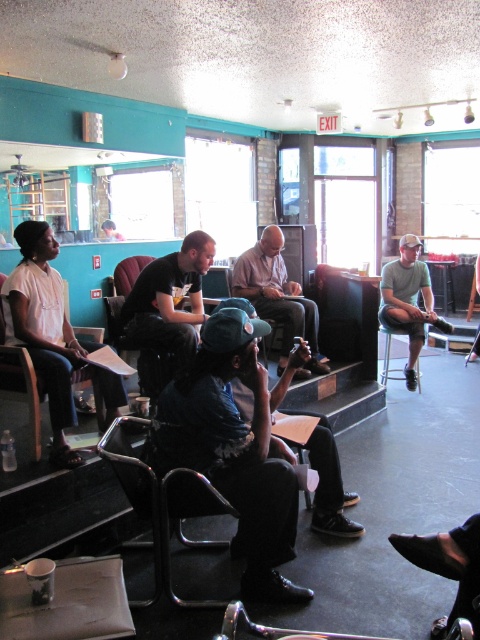
Question: Among these points, which one is nearest to the camera?

Choices:
 (A) (123, 348)
 (B) (280, 284)

Answer: (A)

Question: Which of these objects is positioned farthest from the smooth brown leather jacket at center?

Choices:
 (A) black metal chair at center
 (B) metallic silver chair at left

Answer: (A)

Question: Can you confirm if black matte shirt at center is positioned above smooth brown leather jacket at center?

Choices:
 (A) yes
 (B) no

Answer: (B)

Question: Observing the image, what is the correct spatial positioning of black metal chair at center in reference to smooth brown leather jacket at center?

Choices:
 (A) above
 (B) below

Answer: (B)

Question: Does black matte shirt at center lie behind black metal chair at center?

Choices:
 (A) no
 (B) yes

Answer: (B)

Question: Which of the following is the farthest from the observer?

Choices:
 (A) smooth brown leather jacket at center
 (B) metallic silver chair at left

Answer: (A)